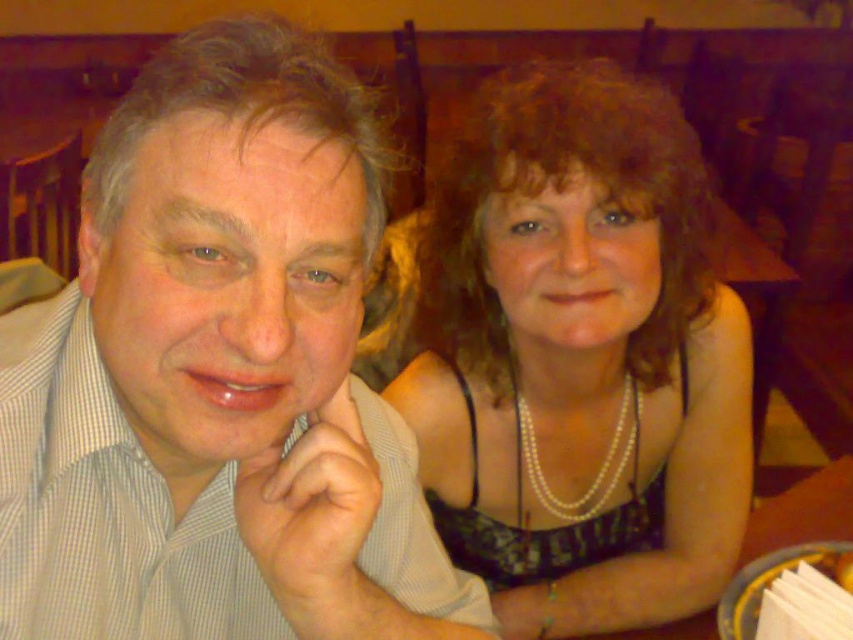
Is pearl necklace at center taller than yellow glossy plate at lower right?

Yes, pearl necklace at center is taller than yellow glossy plate at lower right.

Describe the element at coordinates (579, 358) in the screenshot. The width and height of the screenshot is (853, 640). I see `pearl necklace at center` at that location.

This screenshot has height=640, width=853. Describe the element at coordinates (579, 358) in the screenshot. I see `pearl necklace at center` at that location.

Where is `pearl necklace at center`? This screenshot has height=640, width=853. pearl necklace at center is located at coordinates (579, 358).

Between white checkered shirt at left and yellow glossy plate at lower right, which one has less height?

yellow glossy plate at lower right is shorter.

Is white checkered shirt at left bigger than yellow glossy plate at lower right?

Yes, white checkered shirt at left is bigger than yellow glossy plate at lower right.

Between point (328, 195) and point (642, 632), which one is positioned in front?

Point (328, 195) is in front.

Locate an element on the screen. white checkered shirt at left is located at coordinates (218, 376).

Can you confirm if white checkered shirt at left is positioned above pearl necklace at center?

No, white checkered shirt at left is not above pearl necklace at center.

Locate an element on the screen. The height and width of the screenshot is (640, 853). white checkered shirt at left is located at coordinates (218, 376).

Find the location of a particular element. This screenshot has width=853, height=640. white checkered shirt at left is located at coordinates (218, 376).